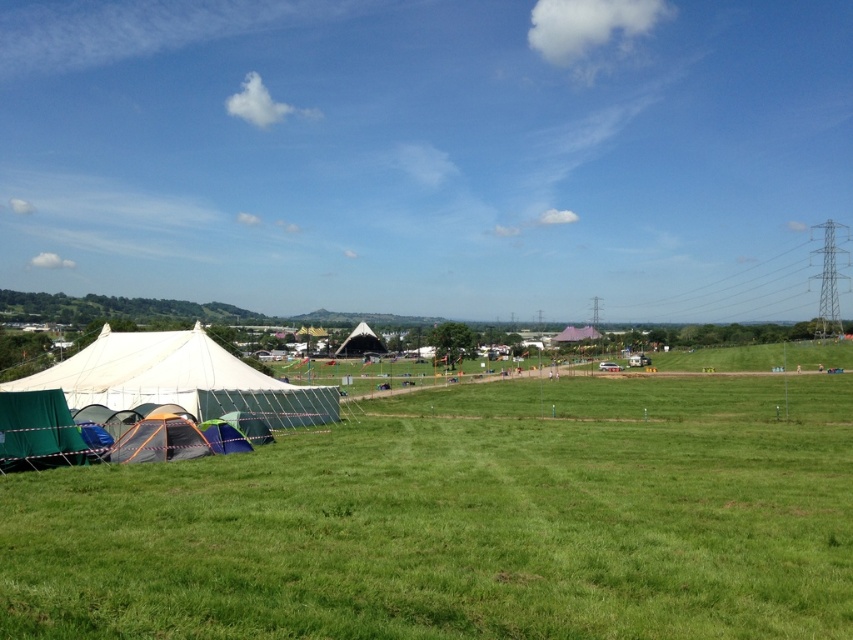
Question: Which point appears farthest from the camera in this image?

Choices:
 (A) (370, 337)
 (B) (221, 426)

Answer: (A)

Question: Based on their relative distances, which object is nearer to the white canvas tent at left?

Choices:
 (A) blue fabric tent at lower left
 (B) white canvas tent at center

Answer: (A)

Question: Where is green grassy field at lower left located in relation to blue fabric tent at lower left in the image?

Choices:
 (A) above
 (B) below

Answer: (B)

Question: Which object is closer to the camera taking this photo?

Choices:
 (A) white canvas tent at center
 (B) blue fabric tent at lower left
 (C) white canvas tent at left

Answer: (C)

Question: Is blue fabric tent at lower left thinner than white canvas tent at center?

Choices:
 (A) yes
 (B) no

Answer: (A)

Question: Can you confirm if white canvas tent at left is positioned below blue fabric tent at lower left?

Choices:
 (A) no
 (B) yes

Answer: (A)